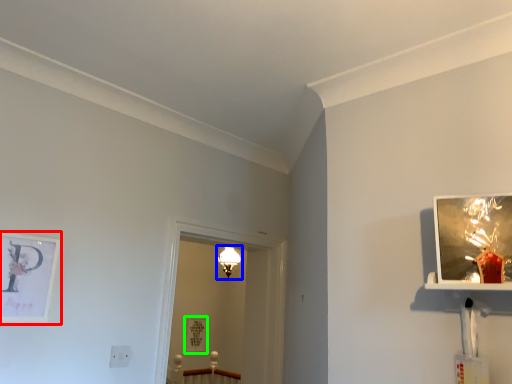
Question: Considering the real-world distances, which object is closest to picture frame (highlighted by a red box)? light fixture (highlighted by a blue box) or picture frame (highlighted by a green box).

Choices:
 (A) light fixture
 (B) picture frame

Answer: (A)